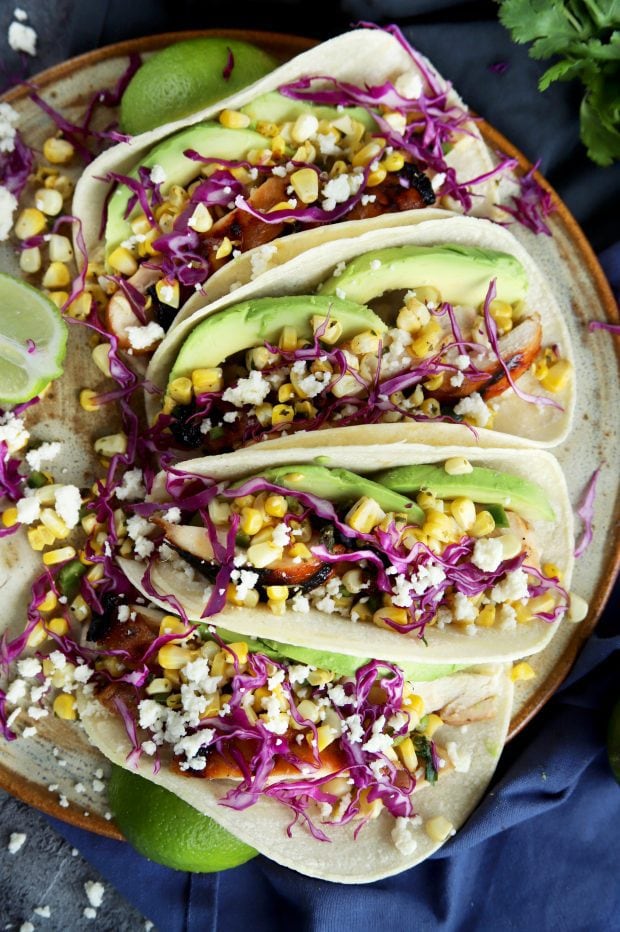
This screenshot has width=620, height=932. In order to click on 1 round plate in this screenshot , I will do `click(30, 773)`.